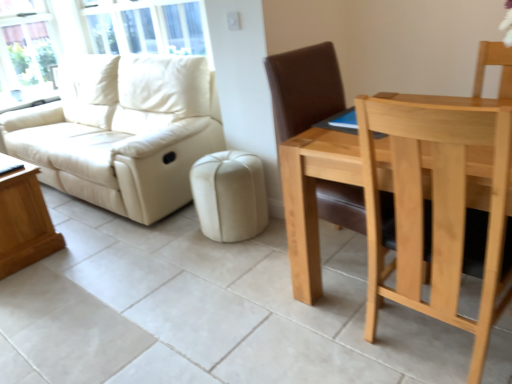
Question: Is light brown wooden coffee table at lower left not inside matte cream leather couch at left?

Choices:
 (A) yes
 (B) no

Answer: (A)

Question: Does light brown wooden coffee table at lower left have a larger size compared to matte cream leather couch at left?

Choices:
 (A) no
 (B) yes

Answer: (A)

Question: Is light brown wooden coffee table at lower left not close to matte cream leather couch at left?

Choices:
 (A) no
 (B) yes

Answer: (A)

Question: Can you confirm if light brown wooden coffee table at lower left is taller than matte cream leather couch at left?

Choices:
 (A) yes
 (B) no

Answer: (B)

Question: Is the position of light brown wooden coffee table at lower left less distant than that of matte cream leather couch at left?

Choices:
 (A) yes
 (B) no

Answer: (A)

Question: Is matte cream leather couch at left situated inside light brown wood chair at right or outside?

Choices:
 (A) outside
 (B) inside

Answer: (A)

Question: Does point (133, 122) appear closer or farther from the camera than point (397, 119)?

Choices:
 (A) farther
 (B) closer

Answer: (A)

Question: Looking at their shapes, would you say matte cream leather couch at left is wider or thinner than light brown wood chair at right?

Choices:
 (A) wide
 (B) thin

Answer: (A)

Question: Based on their sizes in the image, would you say matte cream leather couch at left is bigger or smaller than light brown wood chair at right?

Choices:
 (A) small
 (B) big

Answer: (B)

Question: Considering the positions of light brown wooden coffee table at lower left and light brown wood chair at right in the image, is light brown wooden coffee table at lower left wider or thinner than light brown wood chair at right?

Choices:
 (A) wide
 (B) thin

Answer: (B)

Question: Visually, is light brown wooden coffee table at lower left positioned to the left or to the right of light brown wood chair at right?

Choices:
 (A) left
 (B) right

Answer: (A)

Question: Is light brown wooden coffee table at lower left inside the boundaries of light brown wood chair at right, or outside?

Choices:
 (A) outside
 (B) inside

Answer: (A)

Question: From their relative heights in the image, would you say light brown wooden coffee table at lower left is taller or shorter than light brown wood chair at right?

Choices:
 (A) tall
 (B) short

Answer: (B)

Question: In terms of size, does matte cream leather couch at left appear bigger or smaller than light brown wooden coffee table at lower left?

Choices:
 (A) small
 (B) big

Answer: (B)

Question: Is matte cream leather couch at left in front of or behind light brown wooden coffee table at lower left in the image?

Choices:
 (A) front
 (B) behind

Answer: (B)